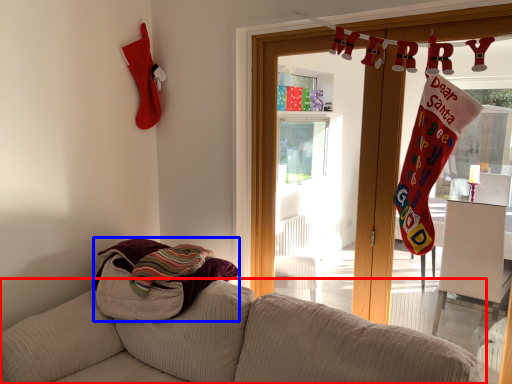
Question: Which of the following is the closest to the observer, studio couch (highlighted by a red box) or beach towel (highlighted by a blue box)?

Choices:
 (A) studio couch
 (B) beach towel

Answer: (A)